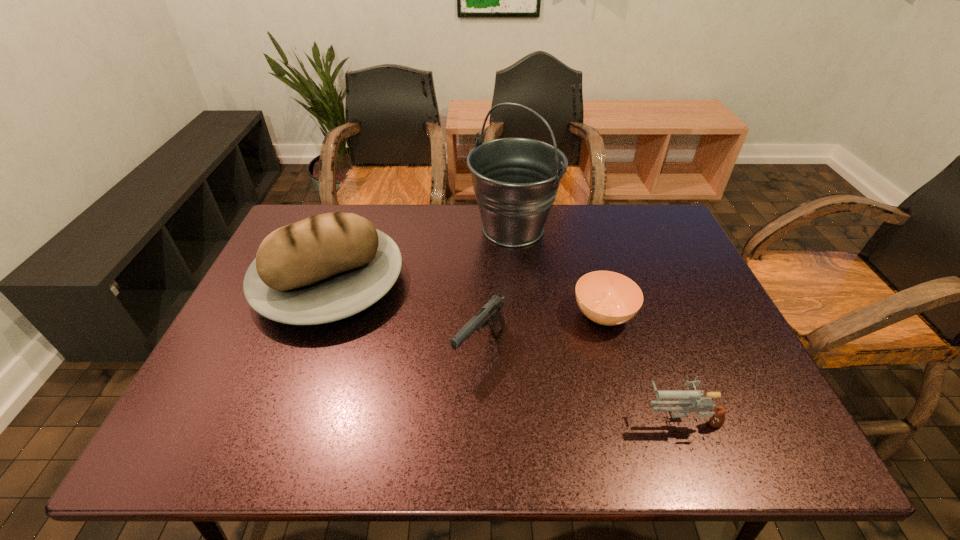
Identify the location of free space between the shortest object and the fourth shortest object. This screenshot has width=960, height=540. (467, 298).

This screenshot has width=960, height=540. I want to click on free space between the soup bowl and the right gun, so click(x=642, y=367).

In order to click on blank region between the nearest object and the tallest object in this screenshot , I will do `click(597, 323)`.

Identify the location of free space between the nearer gun and the soup bowl. (642, 367).

You are a GUI agent. You are given a task and a screenshot of the screen. Output one action in this format:
    pyautogui.click(x=<x>, y=<y>)
    Task: Click on the vacant area that lies between the bucket and the fourth shortest object
    
    Given the screenshot: What is the action you would take?
    pyautogui.click(x=421, y=255)

The height and width of the screenshot is (540, 960). Find the location of `vacant space that's between the leftmost object and the shortest object`. vacant space that's between the leftmost object and the shortest object is located at coordinates (467, 298).

Identify the location of free space between the left gun and the bucket. The height and width of the screenshot is (540, 960). tap(496, 288).

Find the location of a particular element. unoccupied position between the bucket and the farther gun is located at coordinates (496, 288).

Locate an element on the screen. The height and width of the screenshot is (540, 960). object that is the third closest to the nearest object is located at coordinates (515, 180).

Where is `object that is the third closest to the fourth shortest object`? The height and width of the screenshot is (540, 960). object that is the third closest to the fourth shortest object is located at coordinates (607, 298).